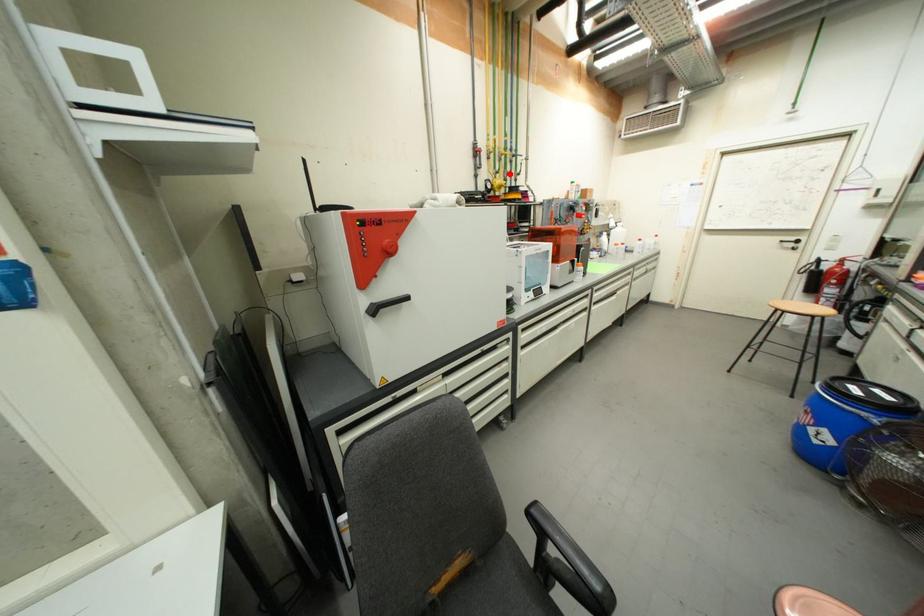
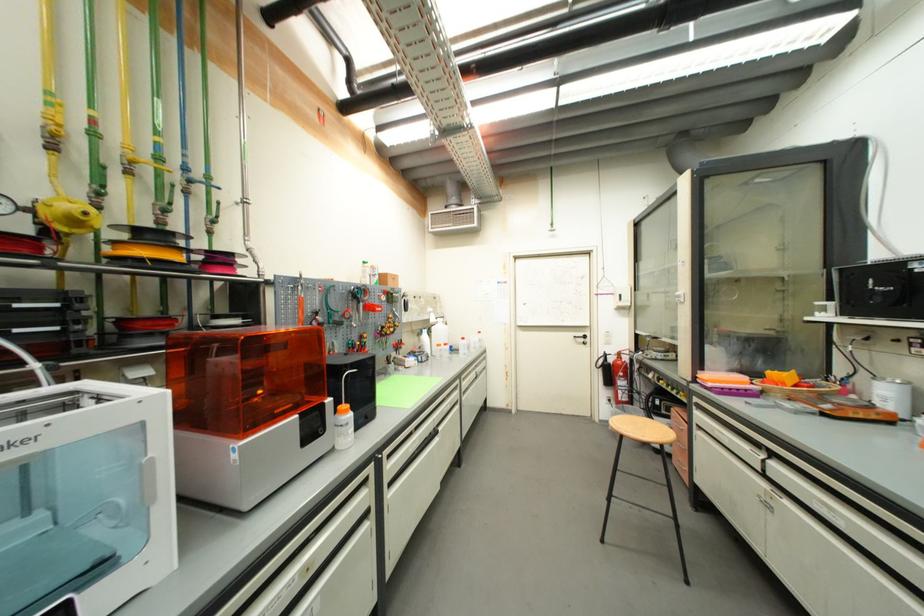
Locate, in the second image, the point that corresponds to the highlighted location in the first image.

(160, 207)